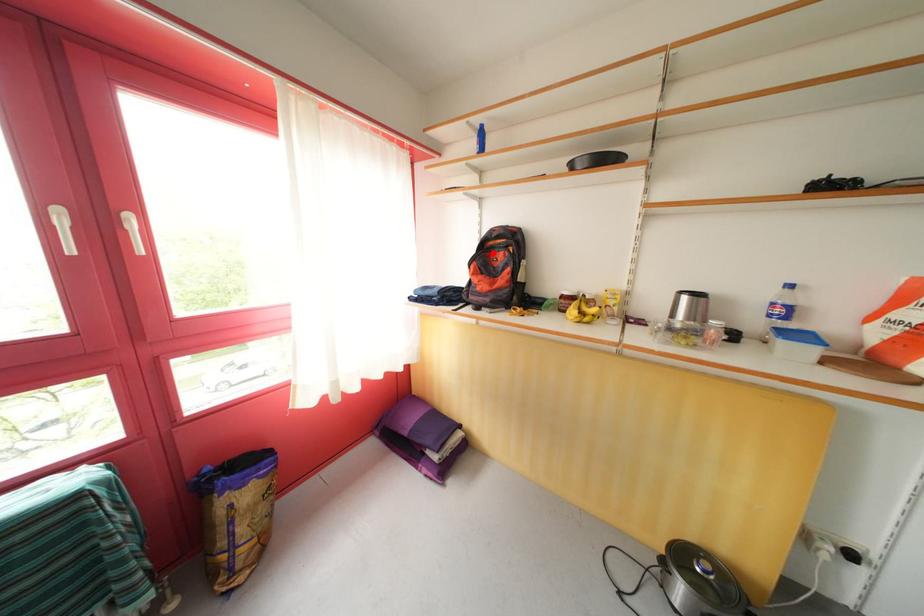
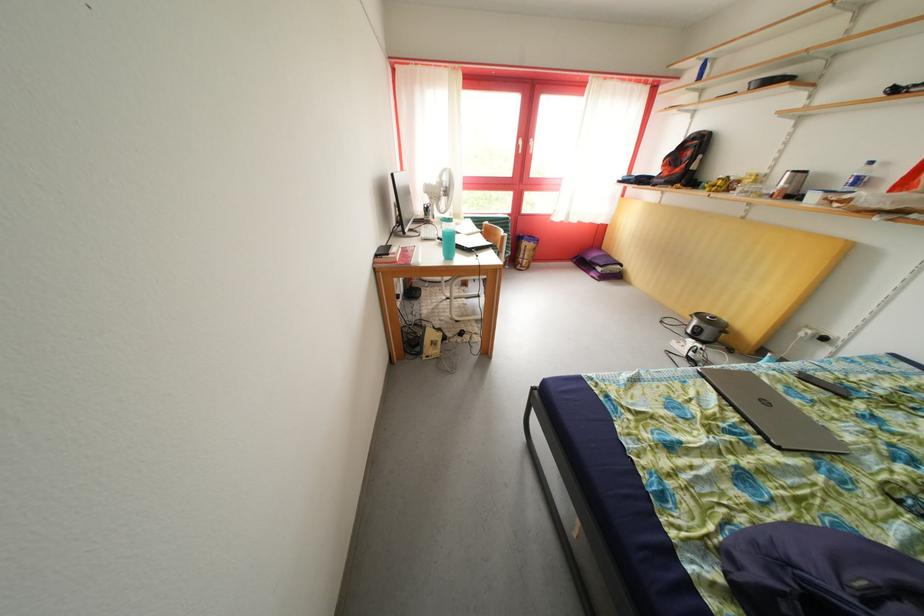
Find the pixel in the second image that matches the highlighted location in the first image.

(689, 153)